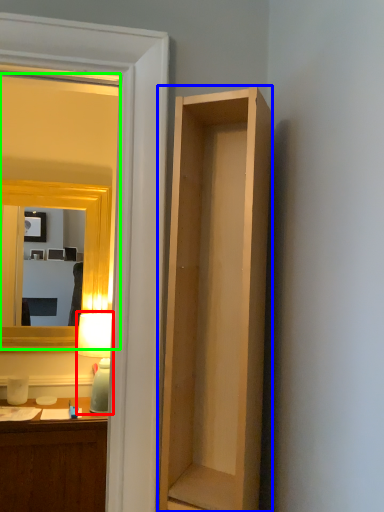
Question: Which object is the farthest from lamp (highlighted by a red box)? Choose among these: cabinetry (highlighted by a blue box) or mirror (highlighted by a green box).

Choices:
 (A) cabinetry
 (B) mirror

Answer: (A)